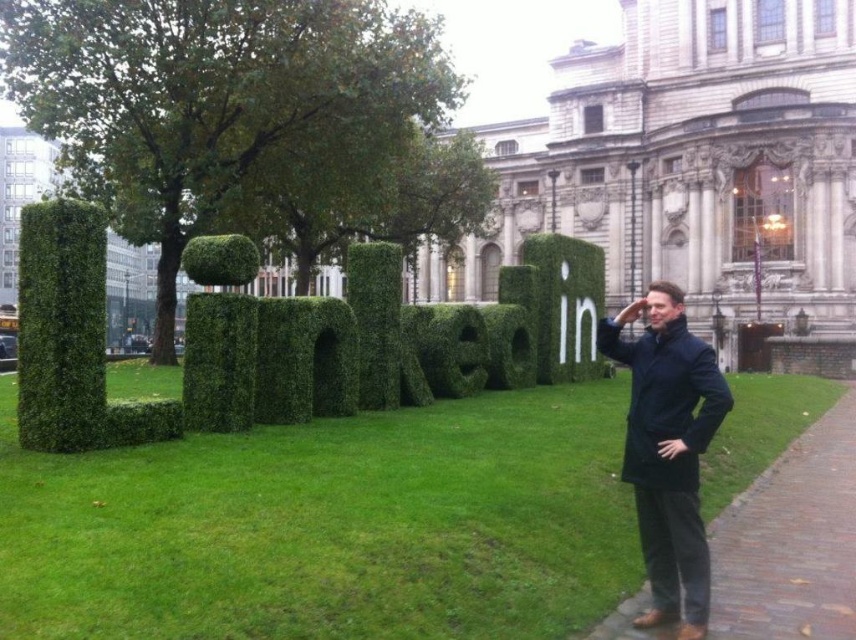
Question: Does green bushy hedge at center lie behind white grass letter at center?

Choices:
 (A) yes
 (B) no

Answer: (B)

Question: Which object is farther from the camera taking this photo?

Choices:
 (A) brick pavement at lower right
 (B) green bushy hedge at center

Answer: (B)

Question: Is brick pavement at lower right bigger than white grass letter at center?

Choices:
 (A) no
 (B) yes

Answer: (B)

Question: Among these objects, which one is nearest to the camera?

Choices:
 (A) green grass at center
 (B) white grass letter at center
 (C) brick pavement at lower right
 (D) dark blue jacket at right

Answer: (A)

Question: Estimate the real-world distances between objects in this image. Which object is farther from the green bushy hedge at center?

Choices:
 (A) dark blue jacket at right
 (B) brick pavement at lower right
 (C) white grass letter at center
 (D) green grass at center

Answer: (B)

Question: Does dark blue jacket at right appear on the right side of white grass letter at center?

Choices:
 (A) no
 (B) yes

Answer: (B)